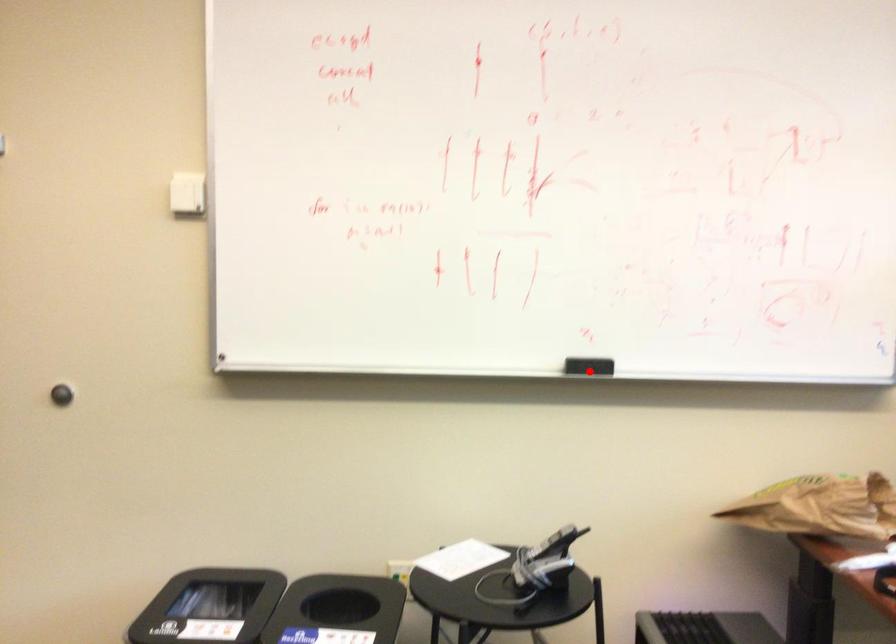
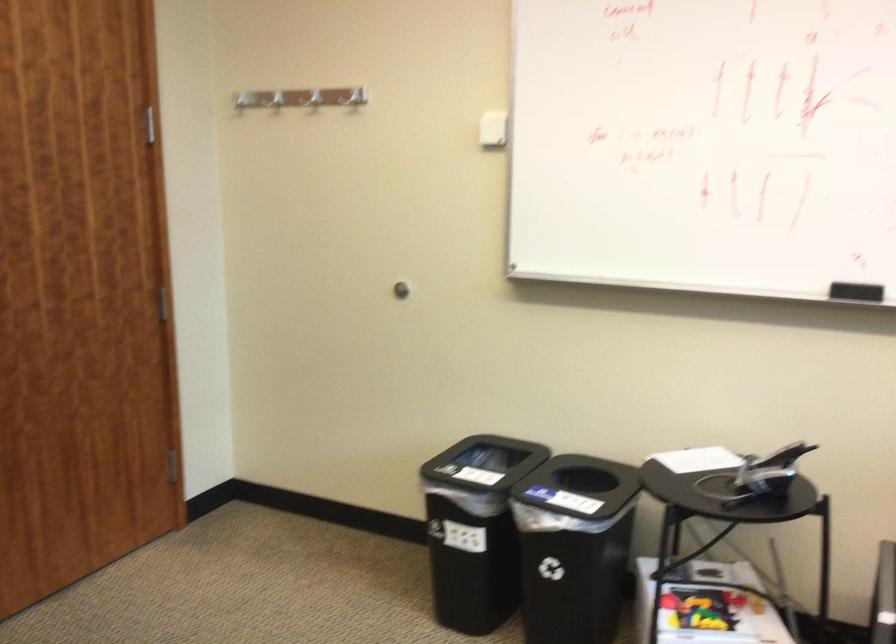
In the second image, find the point that corresponds to the highlighted location in the first image.

(856, 292)